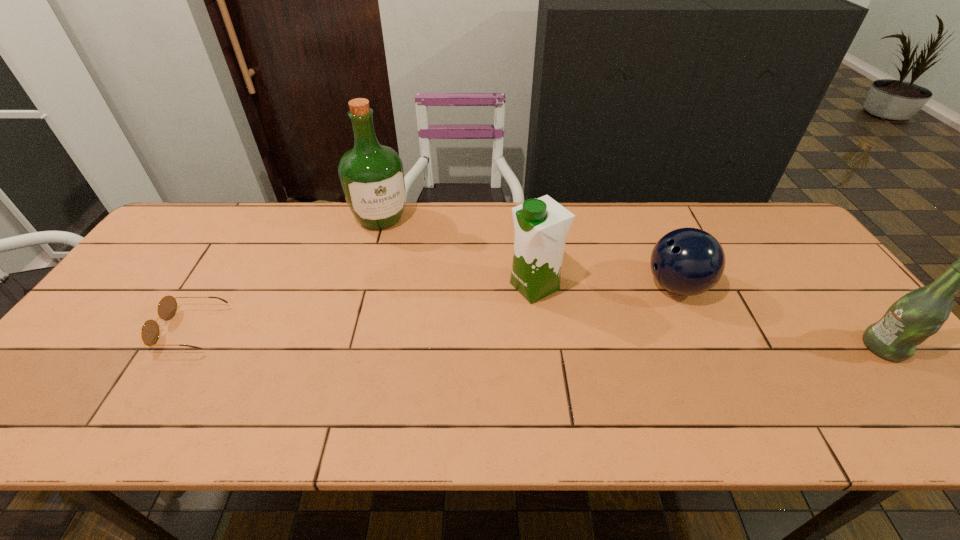
This screenshot has height=540, width=960. Find the location of `free space between the leftmost object and the bowling ball`. free space between the leftmost object and the bowling ball is located at coordinates (434, 307).

You are a GUI agent. You are given a task and a screenshot of the screen. Output one action in this format:
    pyautogui.click(x=<x>, y=<y>)
    Task: Click on the vacant area between the tallest object and the soya milk
    This screenshot has width=960, height=540.
    Given the screenshot: What is the action you would take?
    pyautogui.click(x=458, y=253)

Where is `free space between the third object from left to right and the beer bottle`? The width and height of the screenshot is (960, 540). free space between the third object from left to right and the beer bottle is located at coordinates (709, 316).

Where is `blank region between the third object from right to left and the bowling ball`? blank region between the third object from right to left and the bowling ball is located at coordinates (606, 286).

Identify the location of free space between the farthest object and the third object from left to right. (458, 253).

You are a GUI agent. You are given a task and a screenshot of the screen. Output one action in this format:
    pyautogui.click(x=<x>, y=<y>)
    Task: Click on the free space between the fourth tallest object and the sunglasses
    This screenshot has height=540, width=960.
    Given the screenshot: What is the action you would take?
    pyautogui.click(x=434, y=307)

Locate an element on the screen. object that ranks as the second closest to the leftmost object is located at coordinates (541, 225).

Locate which object is the closest to the bowling ball. Please provide its 2D coordinates. Your answer should be formatted as a tuple, i.e. [(x, y)], where the tuple contains the x and y coordinates of a point satisfying the conditions above.

[(541, 225)]

This screenshot has width=960, height=540. I want to click on vacant area in the image that satisfies the following two spatial constraints: 1. on the front side of the rightmost object; 2. on the surface of the second object from right to left, so click(x=704, y=347).

Where is `free location that satisfies the following two spatial constraints: 1. on the front side of the beer bottle; 2. on the surface of the fourth tallest object`? The image size is (960, 540). free location that satisfies the following two spatial constraints: 1. on the front side of the beer bottle; 2. on the surface of the fourth tallest object is located at coordinates (704, 347).